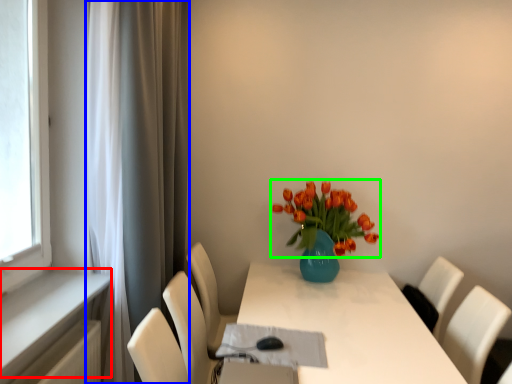
Question: Which object is positioned farthest from window sill (highlighted by a red box)? Select from curtain (highlighted by a blue box) and flower (highlighted by a green box).

Choices:
 (A) curtain
 (B) flower

Answer: (B)